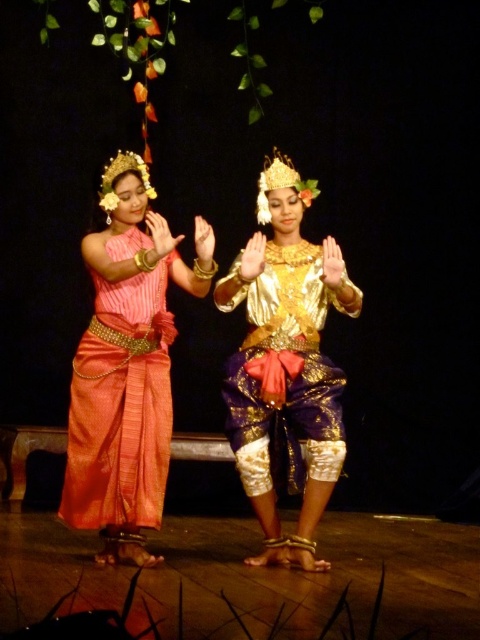
Question: Among these objects, which one is nearest to the camera?

Choices:
 (A) silk sari at center
 (B) gold shiny blouse at center

Answer: (A)

Question: Is silk sari at center above gold shiny blouse at center?

Choices:
 (A) yes
 (B) no

Answer: (A)

Question: Is silk sari at center behind gold shiny blouse at center?

Choices:
 (A) yes
 (B) no

Answer: (B)

Question: Can you confirm if silk sari at center is positioned below gold shiny blouse at center?

Choices:
 (A) no
 (B) yes

Answer: (A)